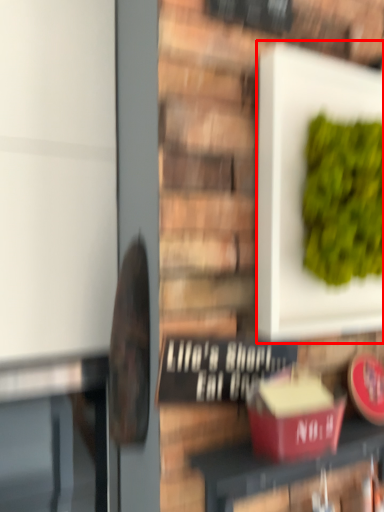
Question: From the image's perspective, considering the relative positions of square (annotated by the red box) and furniture in the image provided, where is square (annotated by the red box) located with respect to the staircase?

Choices:
 (A) above
 (B) below

Answer: (A)